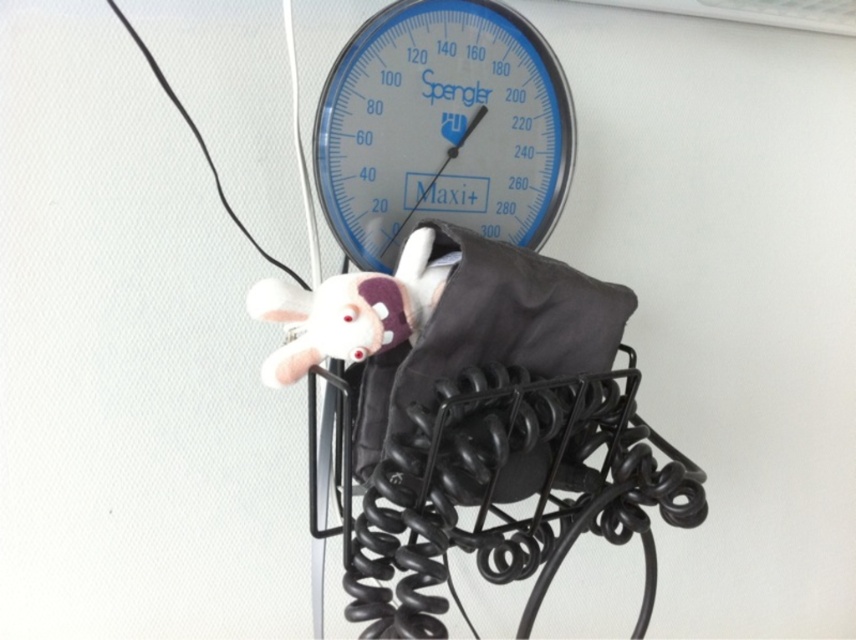
Question: Which point is closer to the camera taking this photo?

Choices:
 (A) (415, 157)
 (B) (354, 340)

Answer: (B)

Question: Is blue glass gauge at center wider than white plush toy at center?

Choices:
 (A) yes
 (B) no

Answer: (A)

Question: In this image, where is blue glass gauge at center located relative to white plush toy at center?

Choices:
 (A) right
 (B) left

Answer: (A)

Question: Considering the relative positions of blue glass gauge at center and white plush toy at center in the image provided, where is blue glass gauge at center located with respect to white plush toy at center?

Choices:
 (A) above
 (B) below

Answer: (A)